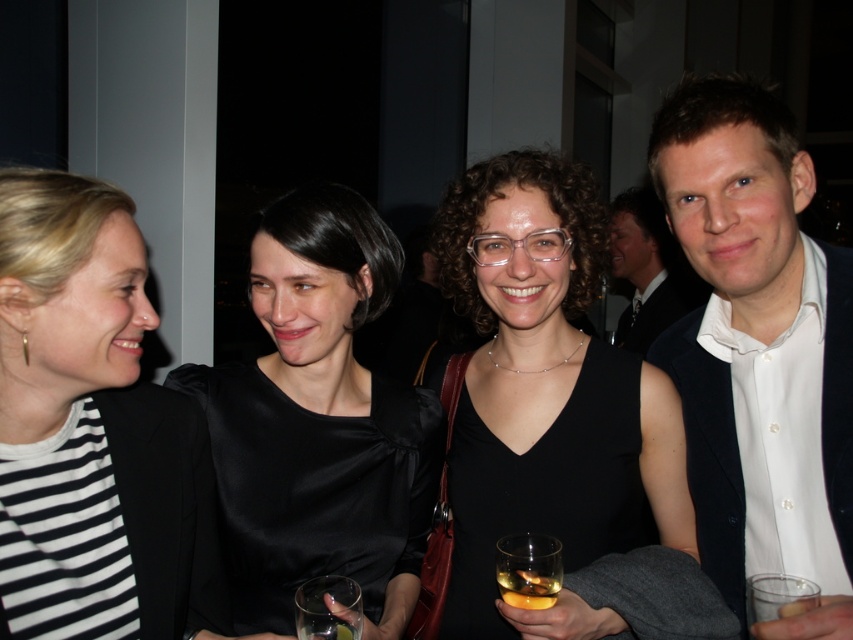
Question: Which is nearer to the transparent glass at lower center?

Choices:
 (A) translucent glass beverage at lower center
 (B) translucent glass at center
 (C) satin black dress at center
 (D) translucent plastic cup at lower right

Answer: (A)

Question: Among these objects, which one is farthest from the camera?

Choices:
 (A) translucent plastic cup at lower right
 (B) satin black dress at center
 (C) translucent glass beverage at lower center
 (D) transparent glass at lower center

Answer: (B)

Question: Among these points, which one is nearest to the camera?

Choices:
 (A) (125, 472)
 (B) (527, 595)
 (C) (761, 589)
 (D) (775, 182)

Answer: (C)

Question: Is white smooth shirt at right below satin black dress at center?

Choices:
 (A) yes
 (B) no

Answer: (B)

Question: Is satin black dress at center thinner than translucent plastic cup at lower right?

Choices:
 (A) yes
 (B) no

Answer: (B)

Question: Does satin black dress at center appear over translucent glass at center?

Choices:
 (A) yes
 (B) no

Answer: (A)